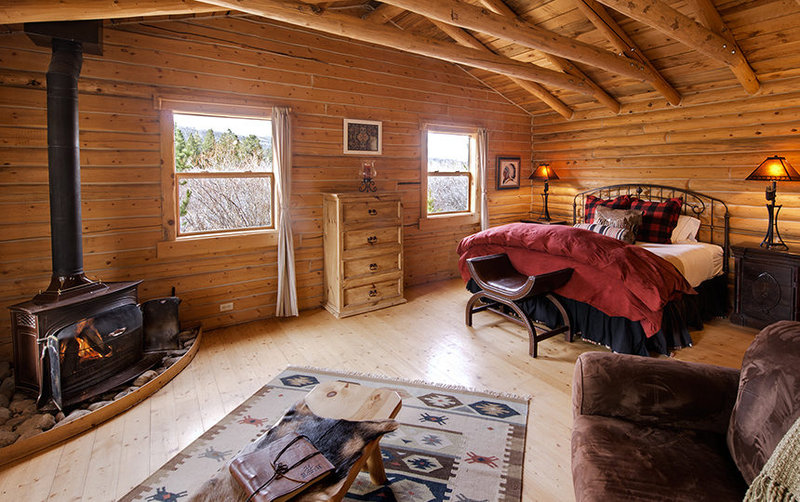
Find the location of `window panes`. window panes is located at coordinates (224, 146), (454, 159), (442, 197), (202, 208).